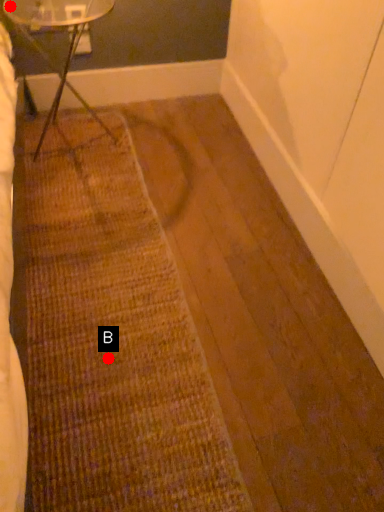
Question: Two points are circled on the image, labeled by A and B beside each circle. Which point is closer to the camera?

Choices:
 (A) A is closer
 (B) B is closer

Answer: (B)